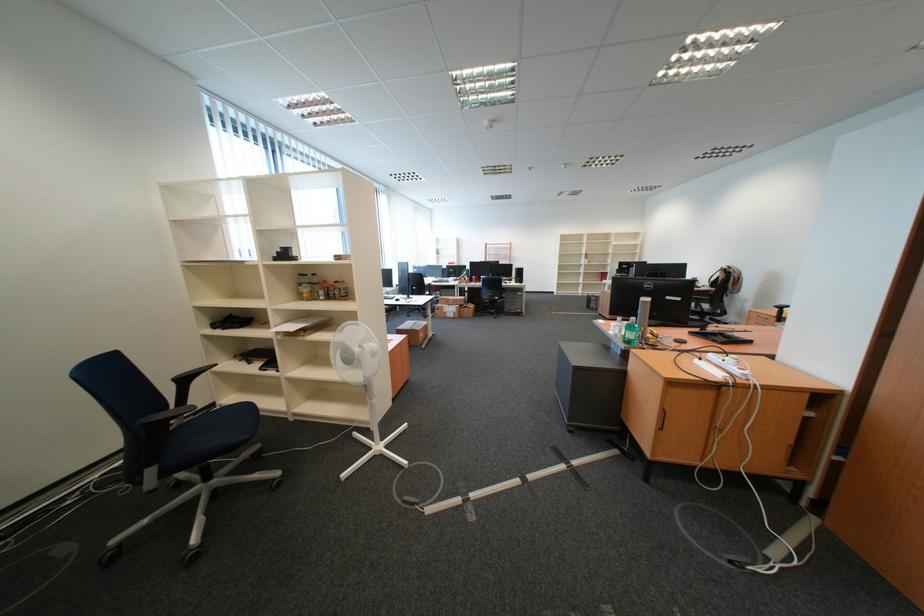
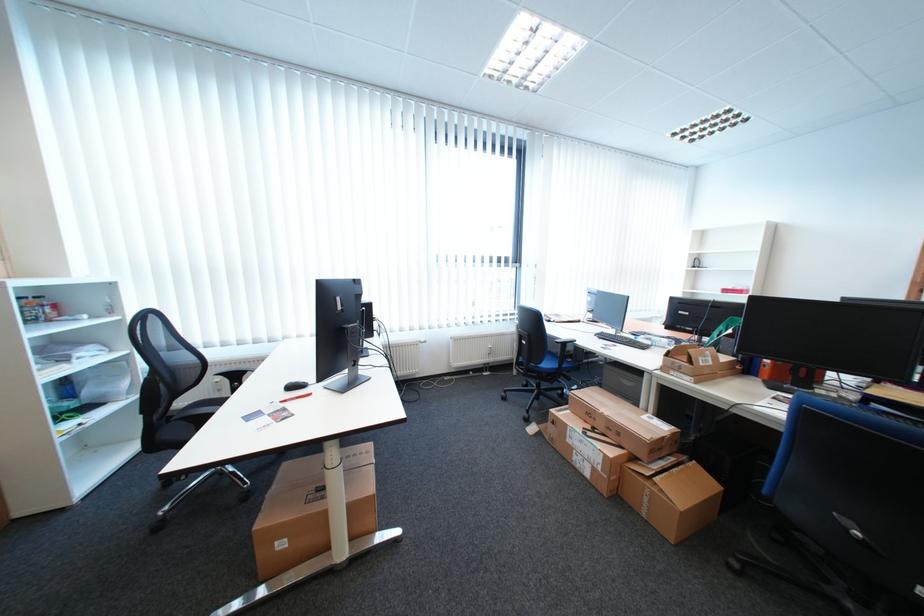
Where in the second image is the point corresponding to [456,312] from the first image?

(580, 442)